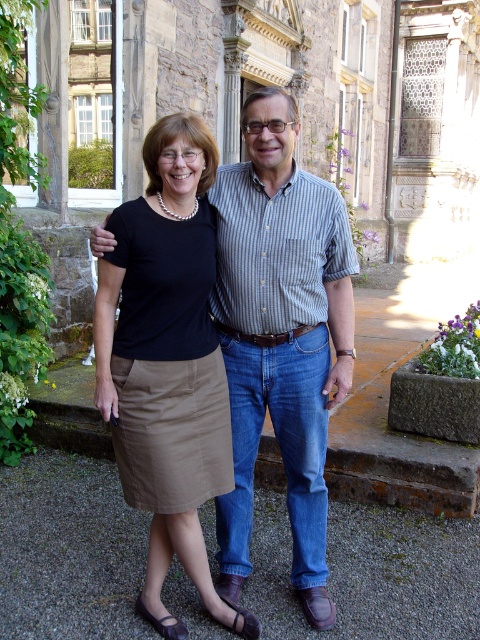
Question: Does striped cotton shirt at center have a lesser width compared to matte khaki skirt at center?

Choices:
 (A) no
 (B) yes

Answer: (B)

Question: Is striped cotton shirt at center to the right of matte khaki skirt at center from the viewer's perspective?

Choices:
 (A) yes
 (B) no

Answer: (A)

Question: Which point appears farthest from the camera in this image?

Choices:
 (A) (213, 397)
 (B) (248, 435)

Answer: (B)

Question: Does striped cotton shirt at center appear on the left side of matte khaki skirt at center?

Choices:
 (A) yes
 (B) no

Answer: (B)

Question: Which of the following is the closest to the observer?

Choices:
 (A) striped cotton shirt at center
 (B) matte khaki skirt at center

Answer: (B)